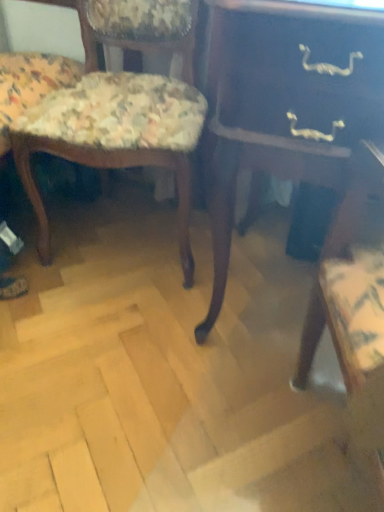
Question: Does dark wood table at center have a larger size compared to floral fabric chair at left, the second chair in the right-to-left sequence?

Choices:
 (A) yes
 (B) no

Answer: (B)

Question: Can you confirm if dark wood table at center is wider than floral fabric chair at left, which appears as the 1th chair when viewed from the left?

Choices:
 (A) no
 (B) yes

Answer: (B)

Question: Is dark wood table at center taller than floral fabric chair at left, the second chair in the right-to-left sequence?

Choices:
 (A) no
 (B) yes

Answer: (B)

Question: Is dark wood table at center thinner than floral fabric chair at left, which appears as the 1th chair when viewed from the left?

Choices:
 (A) yes
 (B) no

Answer: (B)

Question: Is dark wood table at center not within floral fabric chair at left, which appears as the 1th chair when viewed from the left?

Choices:
 (A) no
 (B) yes

Answer: (B)

Question: Considering the positions of point (86, 45) and point (19, 115), is point (86, 45) closer or farther from the camera than point (19, 115)?

Choices:
 (A) closer
 (B) farther

Answer: (B)

Question: Considering the relative positions of floral fabric chair at left, which appears as the 1th chair when viewed from the left, and floral fabric chair at left, acting as the 1th chair starting from the right, in the image provided, is floral fabric chair at left, which appears as the 1th chair when viewed from the left, to the left or to the right of floral fabric chair at left, acting as the 1th chair starting from the right,?

Choices:
 (A) left
 (B) right

Answer: (A)

Question: Considering the positions of floral fabric chair at left, the second chair in the right-to-left sequence, and floral fabric chair at left, the 2th chair positioned from the left, in the image, is floral fabric chair at left, the second chair in the right-to-left sequence, wider or thinner than floral fabric chair at left, the 2th chair positioned from the left,?

Choices:
 (A) thin
 (B) wide

Answer: (B)

Question: Relative to floral fabric chair at left, the 2th chair positioned from the left, is floral fabric chair at left, which appears as the 1th chair when viewed from the left, in front or behind?

Choices:
 (A) behind
 (B) front

Answer: (B)

Question: From a real-world perspective, is dark wood table at center physically located above or below floral fabric chair at left, acting as the 1th chair starting from the right?

Choices:
 (A) above
 (B) below

Answer: (A)

Question: Is point (322, 136) positioned closer to the camera than point (41, 143)?

Choices:
 (A) closer
 (B) farther

Answer: (A)

Question: Is dark wood table at center inside or outside of floral fabric chair at left, acting as the 1th chair starting from the right?

Choices:
 (A) inside
 (B) outside

Answer: (B)

Question: Based on their sizes in the image, would you say dark wood table at center is bigger or smaller than floral fabric chair at left, acting as the 1th chair starting from the right?

Choices:
 (A) big
 (B) small

Answer: (A)

Question: In the image, is floral fabric chair at left, the 2th chair positioned from the left, positioned in front of or behind floral fabric chair at left, the second chair in the right-to-left sequence?

Choices:
 (A) front
 (B) behind

Answer: (B)

Question: Choose the correct answer: Is floral fabric chair at left, the 2th chair positioned from the left, inside floral fabric chair at left, which appears as the 1th chair when viewed from the left, or outside it?

Choices:
 (A) outside
 (B) inside

Answer: (A)